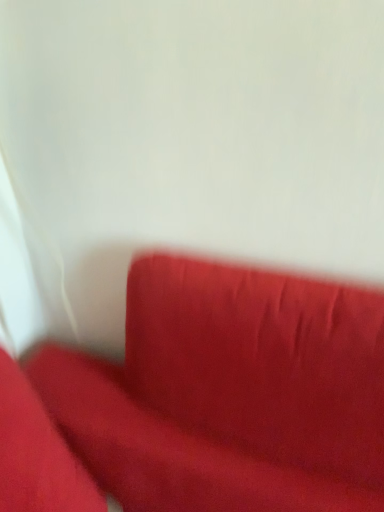
What do you see at coordinates (207, 400) in the screenshot? The image size is (384, 512). I see `suede-like red couch at lower right` at bounding box center [207, 400].

Locate an element on the screen. This screenshot has height=512, width=384. suede-like red couch at lower right is located at coordinates (207, 400).

The image size is (384, 512). What are the coordinates of `suede-like red couch at lower right` in the screenshot? It's located at (207, 400).